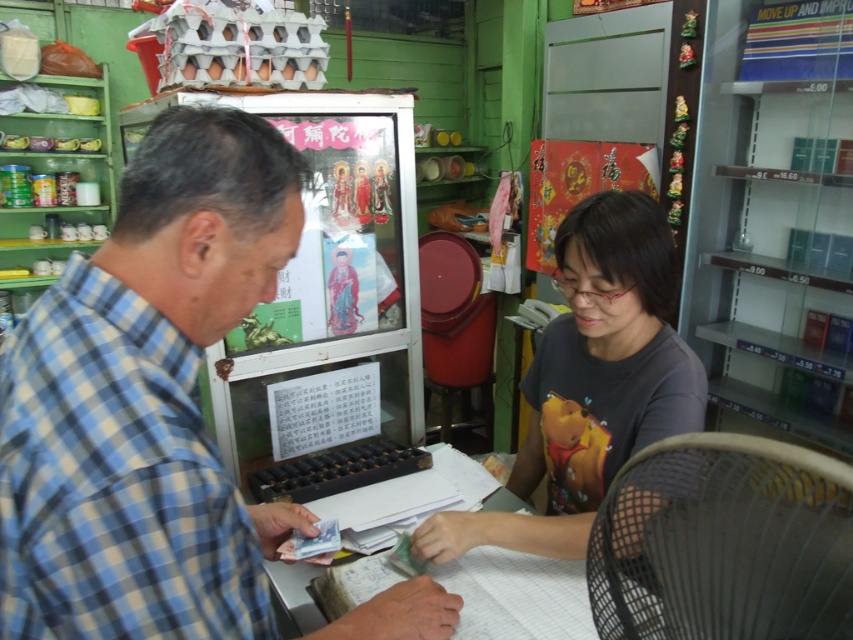
Question: Can you confirm if blue plaid shirt at left is wider than gray matte shirt at center?

Choices:
 (A) no
 (B) yes

Answer: (A)

Question: Does blue plaid shirt at left have a larger size compared to gray matte shirt at center?

Choices:
 (A) yes
 (B) no

Answer: (B)

Question: Which point is closer to the camera?

Choices:
 (A) gray matte shirt at center
 (B) blue plaid shirt at left

Answer: (B)

Question: Does blue plaid shirt at left have a lesser width compared to gray matte shirt at center?

Choices:
 (A) no
 (B) yes

Answer: (B)